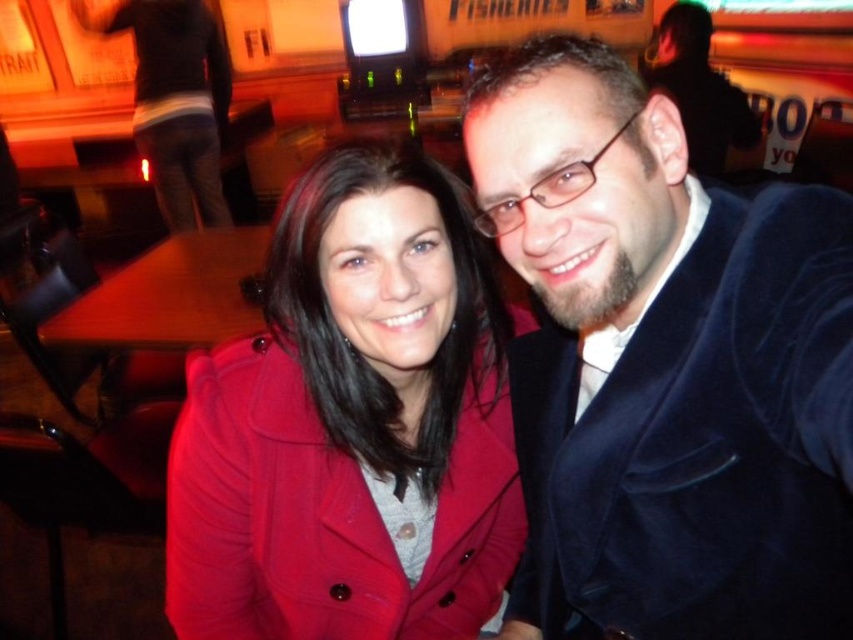
Question: Is matte red coat at center to the right of matte black jacket at upper right from the viewer's perspective?

Choices:
 (A) no
 (B) yes

Answer: (A)

Question: Among these points, which one is nearest to the camera?

Choices:
 (A) (694, 84)
 (B) (727, 243)

Answer: (B)

Question: Observing the image, what is the correct spatial positioning of velvet blue jacket at right in reference to matte black jacket at upper right?

Choices:
 (A) above
 (B) below

Answer: (B)

Question: Estimate the real-world distances between objects in this image. Which object is farther from the matte red coat at center?

Choices:
 (A) wooden table at lower left
 (B) velvet blue jacket at right

Answer: (A)

Question: Does velvet blue jacket at right have a smaller size compared to matte black jacket at upper right?

Choices:
 (A) no
 (B) yes

Answer: (B)

Question: Which point is closer to the camera taking this photo?

Choices:
 (A) (161, 332)
 (B) (830, 557)
 (C) (450, 424)

Answer: (B)